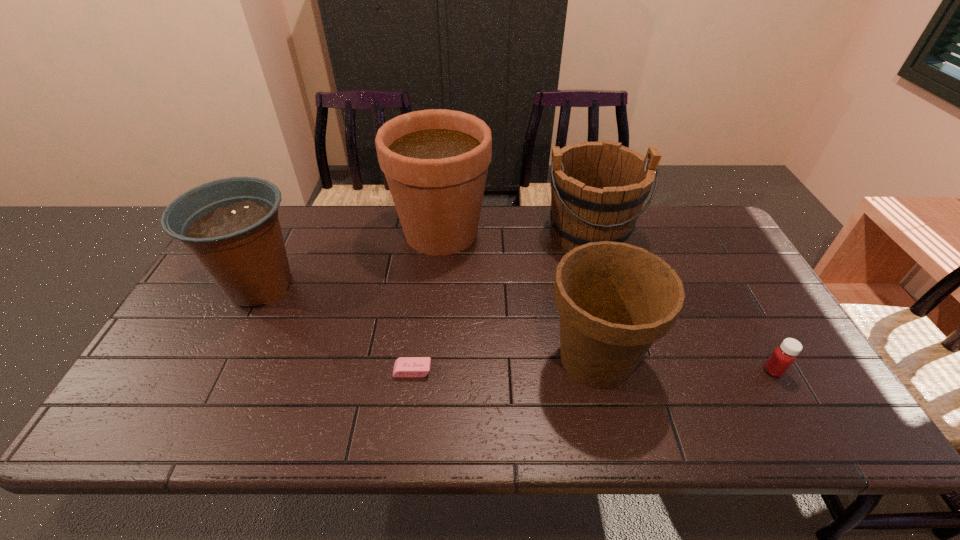
Image resolution: width=960 pixels, height=540 pixels. I want to click on vacant space that is in between the leftmost flowerpot and the eraser, so pyautogui.click(x=336, y=328).

Image resolution: width=960 pixels, height=540 pixels. What are the coordinates of `blank region between the wine bucket and the leftmost object` in the screenshot? It's located at (425, 259).

Locate an element on the screen. vacant space that's between the rightmost flowerpot and the leftmost object is located at coordinates (428, 322).

Find the location of a particular element. unoccupied area between the shortest object and the leftmost flowerpot is located at coordinates (336, 328).

Locate an element on the screen. Image resolution: width=960 pixels, height=540 pixels. object that is the fourth closest to the rightmost flowerpot is located at coordinates (681, 226).

Find the location of `object that stands as the second closest to the wine bucket`. object that stands as the second closest to the wine bucket is located at coordinates (246, 330).

You are a GUI agent. You are given a task and a screenshot of the screen. Output one action in this format:
    pyautogui.click(x=<x>, y=<y>)
    Task: Click on the flowerpot identified as the closest to the rightmost flowerpot
    
    Given the screenshot: What is the action you would take?
    pyautogui.click(x=605, y=387)

Locate an element on the screen. This screenshot has height=540, width=960. flowerpot identified as the closest to the leftmost object is located at coordinates (605, 387).